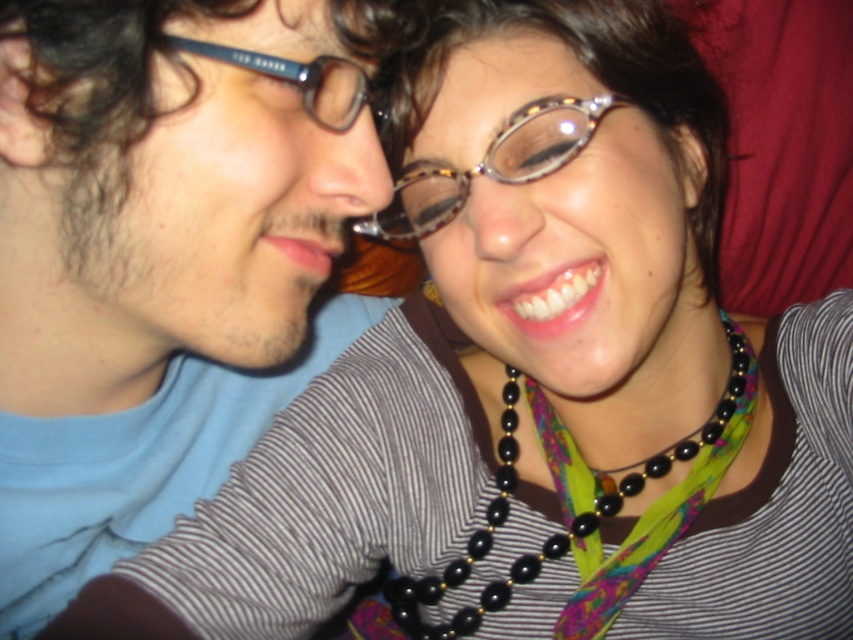
Question: Considering the relative positions of black beaded necklace at center and tortoiseshell acetate glasses at center in the image provided, where is black beaded necklace at center located with respect to tortoiseshell acetate glasses at center?

Choices:
 (A) left
 (B) right

Answer: (B)

Question: Among these objects, which one is farthest from the camera?

Choices:
 (A) black beaded necklace at center
 (B) matte blue plastic glasses at upper left
 (C) matte blue shirt at left
 (D) tortoiseshell acetate glasses at center

Answer: (A)

Question: Can you confirm if matte blue shirt at left is smaller than matte blue plastic glasses at upper left?

Choices:
 (A) yes
 (B) no

Answer: (B)

Question: Can you confirm if matte blue shirt at left is thinner than matte blue plastic glasses at upper left?

Choices:
 (A) no
 (B) yes

Answer: (A)

Question: Which point is closer to the camera?

Choices:
 (A) (105, 84)
 (B) (454, 180)
 (C) (271, 72)

Answer: (A)

Question: Which point is farther to the camera?

Choices:
 (A) matte blue shirt at left
 (B) black beaded necklace at center
 (C) tortoiseshell acetate glasses at center

Answer: (B)